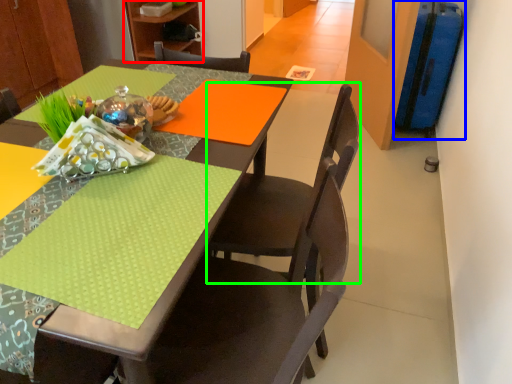
Question: Which object is positioned farthest from bookshelf (highlighted by a red box)? Select from luggage (highlighted by a blue box) and chair (highlighted by a green box).

Choices:
 (A) luggage
 (B) chair

Answer: (B)